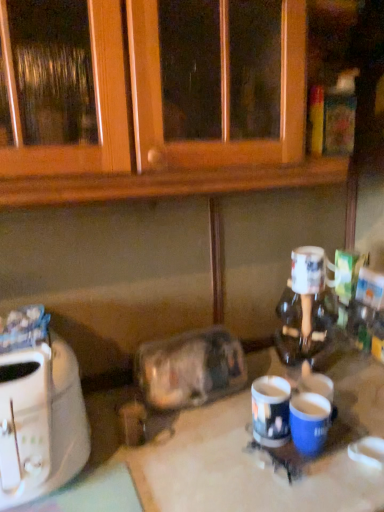
Where is `vacant area that lies in front of blue matte mug at lower center, the 1th coffee cup from the bottom`? vacant area that lies in front of blue matte mug at lower center, the 1th coffee cup from the bottom is located at coordinates (319, 485).